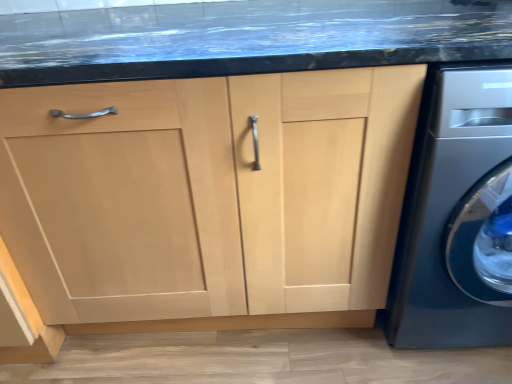
Question: Choose the correct answer: Is satin silver washing machine at lower right inside natural wood cabinet at center or outside it?

Choices:
 (A) inside
 (B) outside

Answer: (B)

Question: From a real-world perspective, is satin silver washing machine at lower right above or below natural wood cabinet at center?

Choices:
 (A) above
 (B) below

Answer: (A)

Question: Is satin silver washing machine at lower right in front of or behind natural wood cabinet at center in the image?

Choices:
 (A) behind
 (B) front

Answer: (B)

Question: From their relative heights in the image, would you say natural wood cabinet at center is taller or shorter than satin silver washing machine at lower right?

Choices:
 (A) short
 (B) tall

Answer: (A)

Question: Considering their positions, is natural wood cabinet at center located in front of or behind satin silver washing machine at lower right?

Choices:
 (A) behind
 (B) front

Answer: (A)

Question: Is natural wood cabinet at center wider or thinner than satin silver washing machine at lower right?

Choices:
 (A) wide
 (B) thin

Answer: (B)

Question: From a real-world perspective, relative to satin silver washing machine at lower right, is natural wood cabinet at center vertically above or below?

Choices:
 (A) below
 (B) above

Answer: (A)